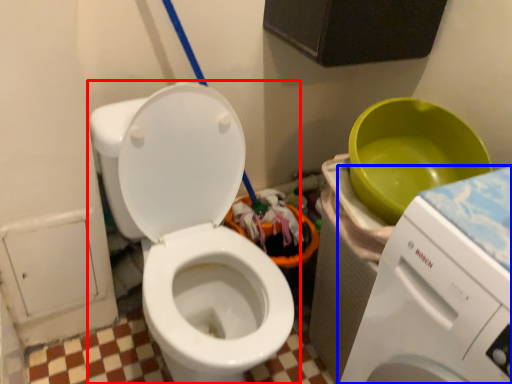
Question: Among these objects, which one is nearest to the camera, toilet (highlighted by a red box) or washing machine (highlighted by a blue box)?

Choices:
 (A) toilet
 (B) washing machine

Answer: (B)